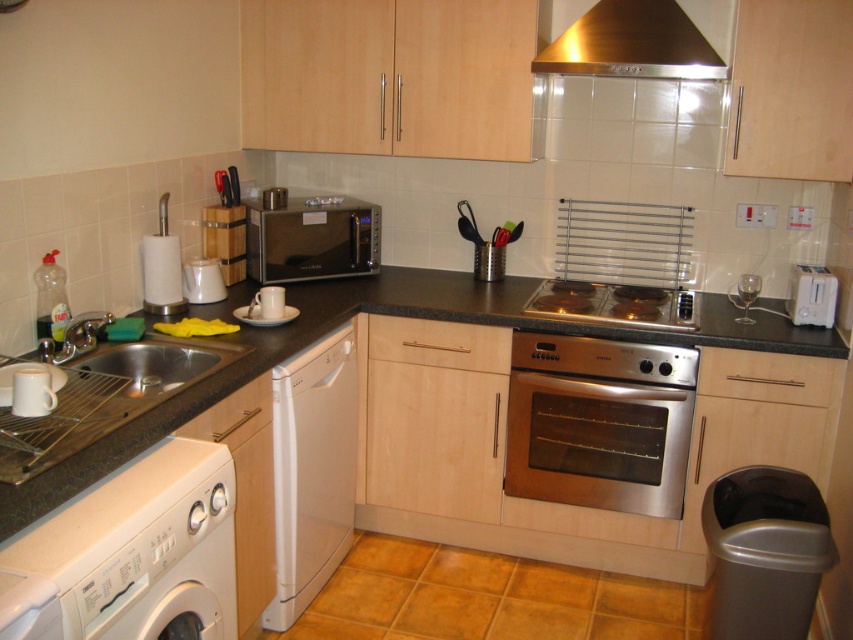
Question: Which object is positioned closest to the black granite countertop at lower left?

Choices:
 (A) satin silver microwave at center
 (B) stainless steel oven at center
 (C) white plastic washing machine at lower left
 (D) stainless steel electric stove at center

Answer: (D)

Question: Is white plastic washing machine at lower left wider than satin silver microwave at center?

Choices:
 (A) no
 (B) yes

Answer: (A)

Question: From the image, what is the correct spatial relationship of stainless steel exhaust hood at upper center in relation to stainless steel sink at lower left?

Choices:
 (A) right
 (B) left

Answer: (A)

Question: Which point is farther from the camera taking this photo?

Choices:
 (A) (606, 284)
 (B) (202, 369)
 (C) (294, 252)
 (D) (538, 360)

Answer: (A)

Question: Is white plastic dishwasher at lower left to the left of stainless steel sink at lower left from the viewer's perspective?

Choices:
 (A) no
 (B) yes

Answer: (A)

Question: Which object is closer to the camera taking this photo?

Choices:
 (A) stainless steel sink at lower left
 (B) stainless steel electric stove at center
 (C) black granite countertop at lower left

Answer: (C)